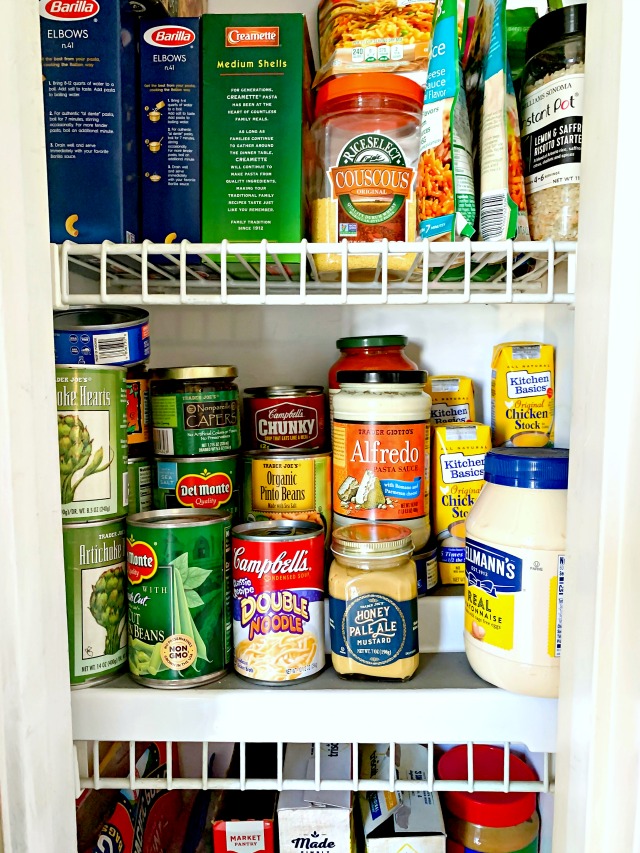
I want to click on items on the top shelf, so click(88, 112), click(162, 112), click(249, 114), click(355, 134), click(386, 36), click(451, 107), click(488, 123), click(553, 123).